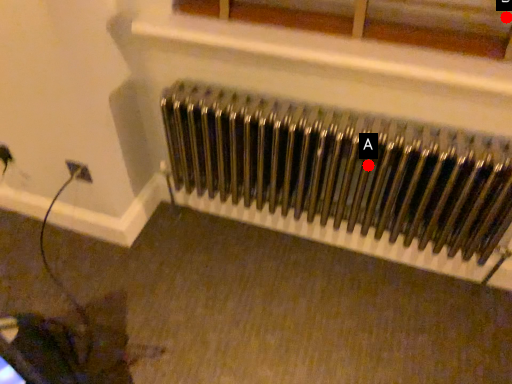
Question: Two points are circled on the image, labeled by A and B beside each circle. Among these points, which one is farthest from the camera?

Choices:
 (A) A is further
 (B) B is further

Answer: (A)